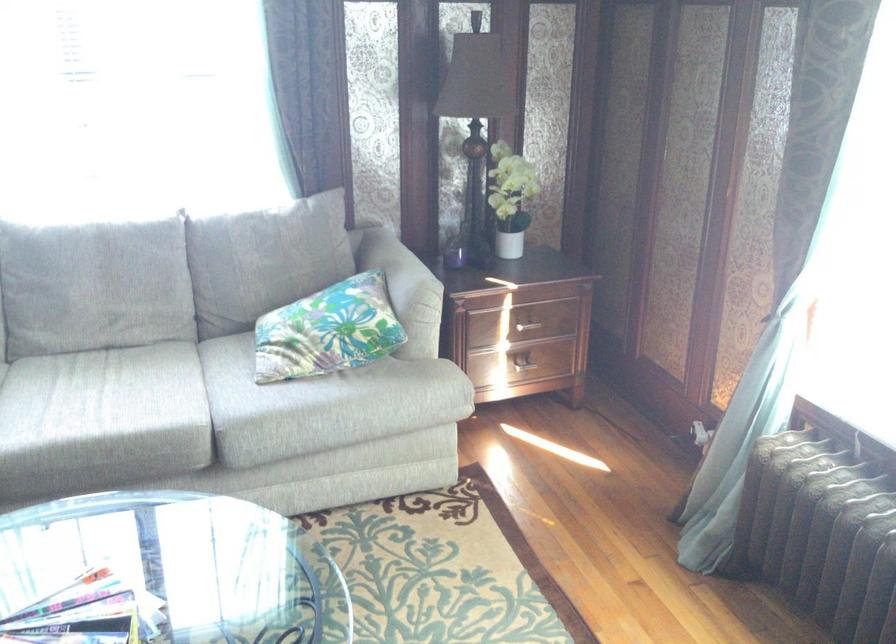
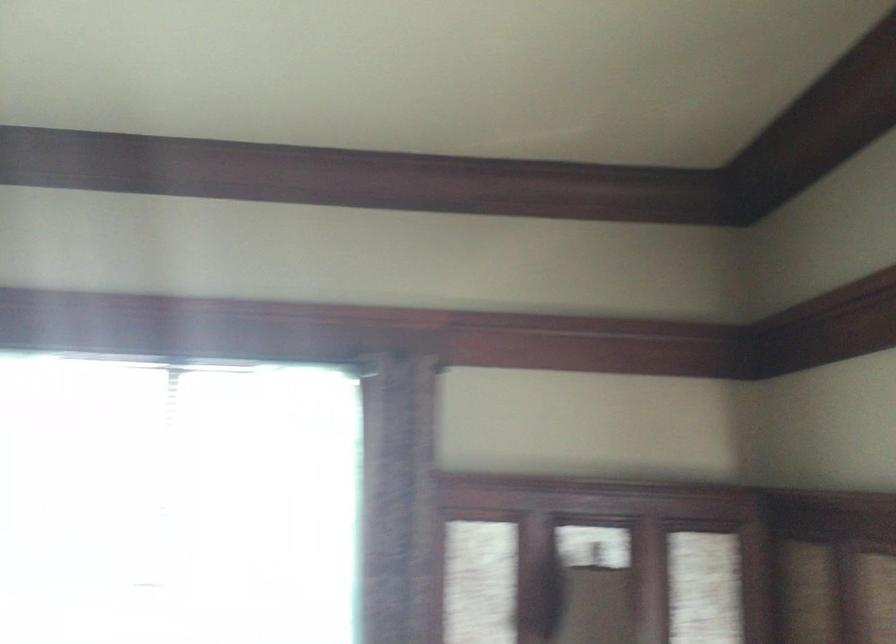
The images are taken continuously from a first-person perspective. In which direction is your viewpoint rotating?

The rotation direction of the camera is left-up.